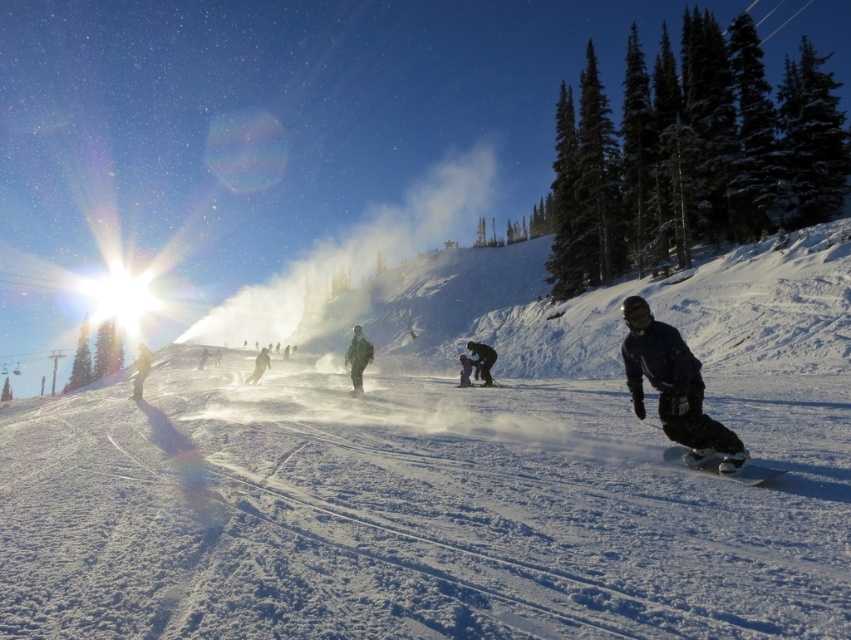
Is dark blue snowboard at center to the right of dark blue snowboarder at center from the viewer's perspective?

Yes, dark blue snowboard at center is to the right of dark blue snowboarder at center.

Between point (667, 416) and point (463, 358), which one is positioned in front?

Point (667, 416)

You are a GUI agent. You are given a task and a screenshot of the screen. Output one action in this format:
    pyautogui.click(x=<x>, y=<y>)
    Task: Click on the dark blue snowboard at center
    
    Given the screenshot: What is the action you would take?
    pyautogui.click(x=672, y=387)

Does dark blue snowboard at center have a greater width compared to black matte snowboarder at center?

Indeed, dark blue snowboard at center has a greater width compared to black matte snowboarder at center.

Which is in front, point (718, 428) or point (480, 353)?

Point (718, 428) is more forward.

Image resolution: width=851 pixels, height=640 pixels. Find the location of `dark blue snowboard at center`. dark blue snowboard at center is located at coordinates (672, 387).

Who is positioned more to the right, green snowsuit at center or dark blue snowboarder at center?

dark blue snowboarder at center

Which is behind, point (136, 390) or point (467, 371)?

Point (136, 390)

In the scene shown: Who is more distant from viewer, (x=147, y=362) or (x=473, y=364)?

Positioned behind is point (x=147, y=362).

Identify the location of green snowsuit at center. (140, 371).